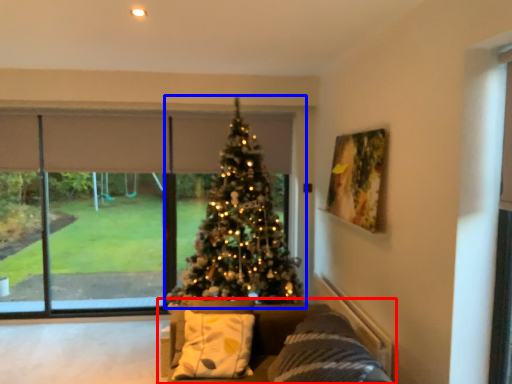
Question: Which object appears farthest to the camera in this image, studio couch (highlighted by a red box) or christmas tree (highlighted by a blue box)?

Choices:
 (A) studio couch
 (B) christmas tree

Answer: (B)